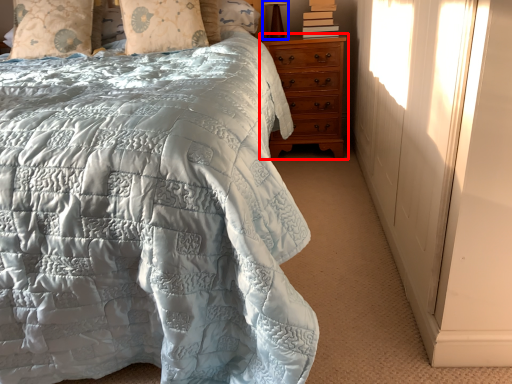
Question: Which object appears farthest to the camera in this image, chest of drawers (highlighted by a red box) or table lamp (highlighted by a blue box)?

Choices:
 (A) chest of drawers
 (B) table lamp

Answer: (B)